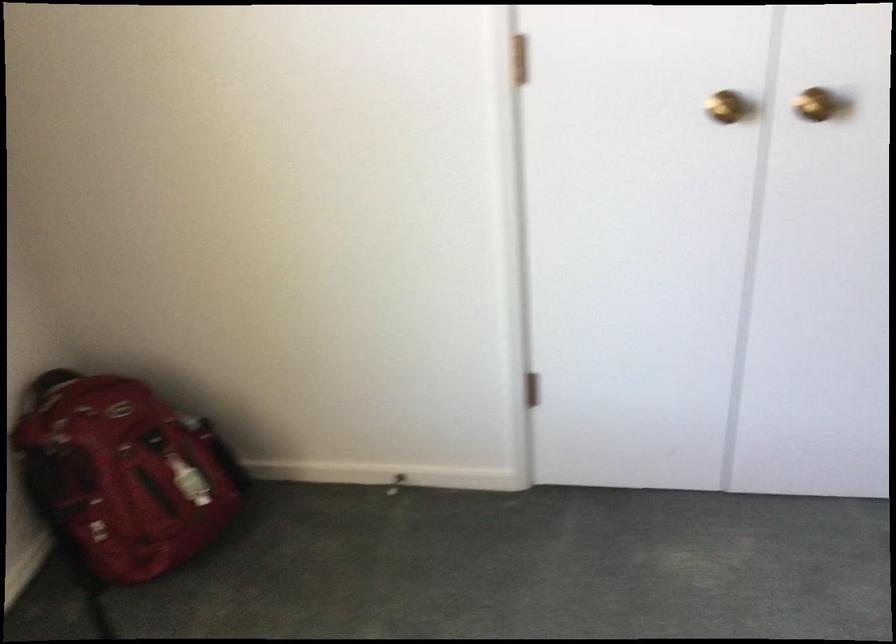
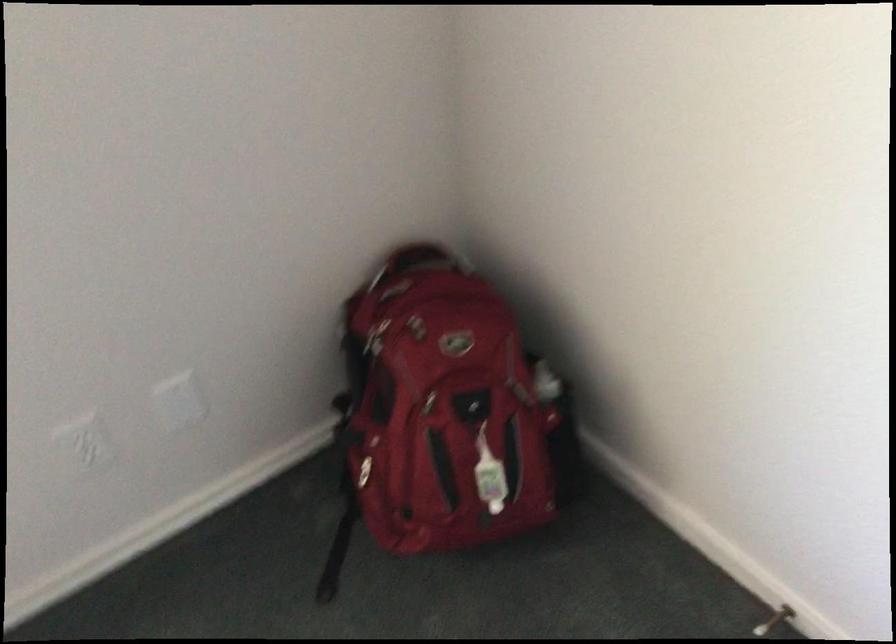
First-person continuous shooting, in which direction is the camera rotating?

The camera's rotation is toward left-down.